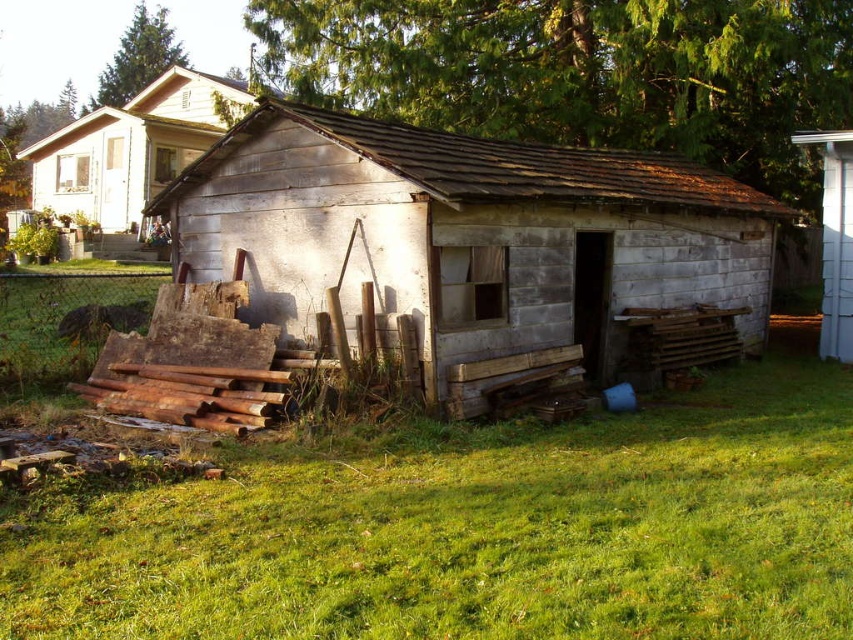
Who is taller, green grass at lower center or white wood fence at right?

white wood fence at right

Between green grass at lower center and white wood fence at right, which one has less height?

green grass at lower center is shorter.

Is point (358, 593) closer to camera compared to point (810, 132)?

Yes, point (358, 593) is closer to viewer.

The width and height of the screenshot is (853, 640). I want to click on green grass at lower center, so click(471, 531).

The image size is (853, 640). Describe the element at coordinates (466, 234) in the screenshot. I see `weathered wood hut at center` at that location.

Is point (189, 200) behind point (177, 80)?

That is False.

The image size is (853, 640). In order to click on weathered wood hut at center in this screenshot , I will do `click(466, 234)`.

Is weathered wood hut at center bigger than white wood fence at right?

Yes, weathered wood hut at center is bigger than white wood fence at right.

Which is in front, point (495, 296) or point (844, 285)?

Point (495, 296) is in front.

The image size is (853, 640). In order to click on weathered wood hut at center in this screenshot , I will do `click(466, 234)`.

Locate an element on the screen. This screenshot has height=640, width=853. weathered wood hut at center is located at coordinates (466, 234).